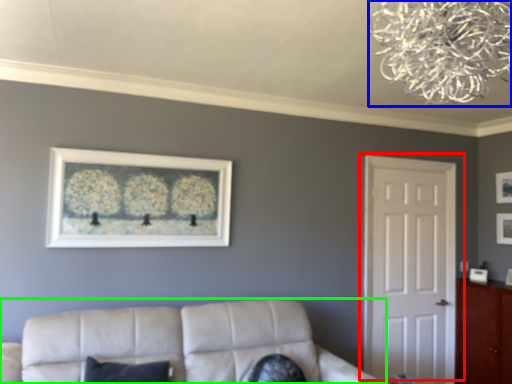
Question: Which object is the farthest from door (highlighted by a red box)? Choose among these: lamp (highlighted by a blue box) or studio couch (highlighted by a green box).

Choices:
 (A) lamp
 (B) studio couch

Answer: (A)